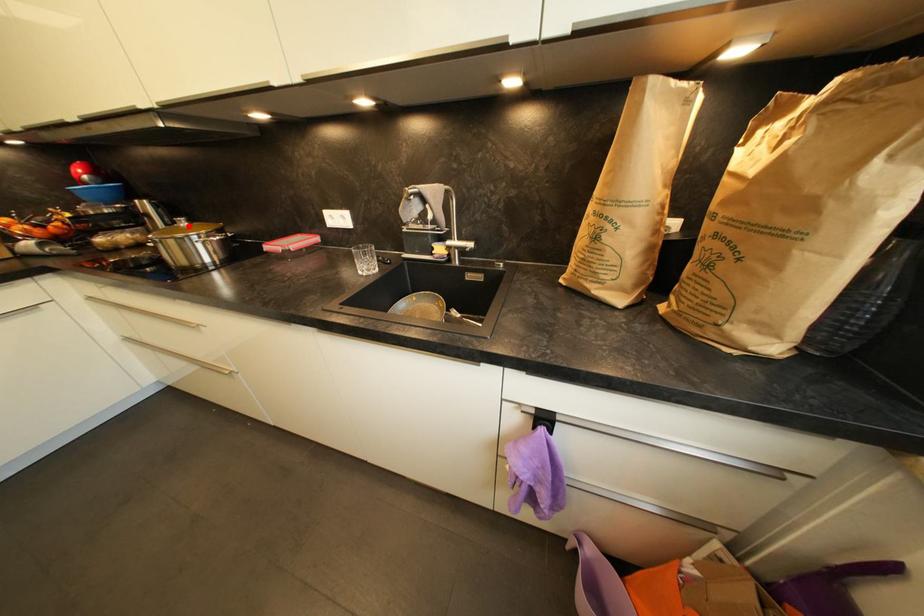
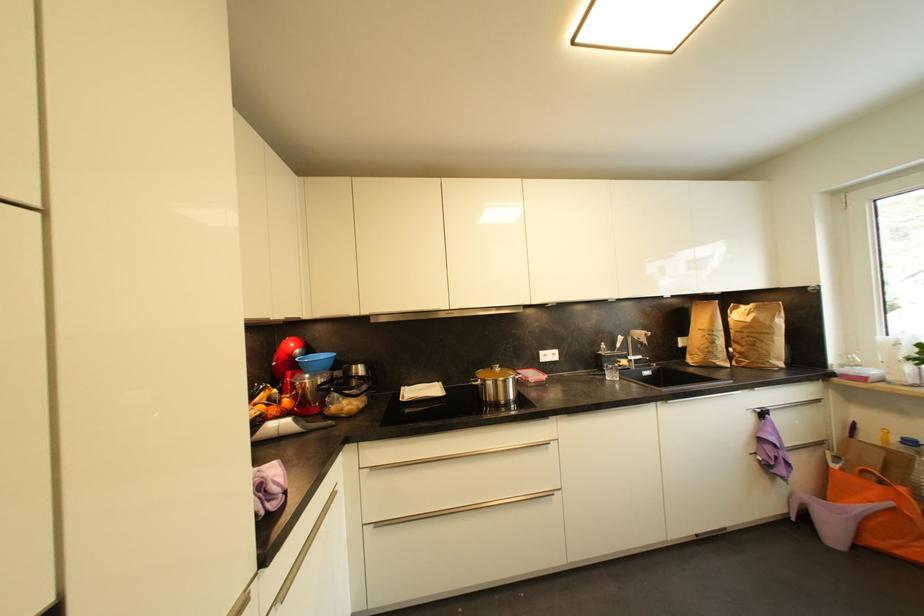
The point at the highlighted location is marked in the first image. Where is the corresponding point in the second image?

(503, 371)